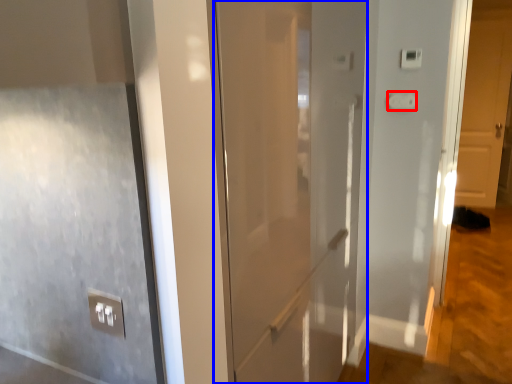
Question: Which object appears farthest to the camera in this image, light switch (highlighted by a red box) or door (highlighted by a blue box)?

Choices:
 (A) light switch
 (B) door

Answer: (A)